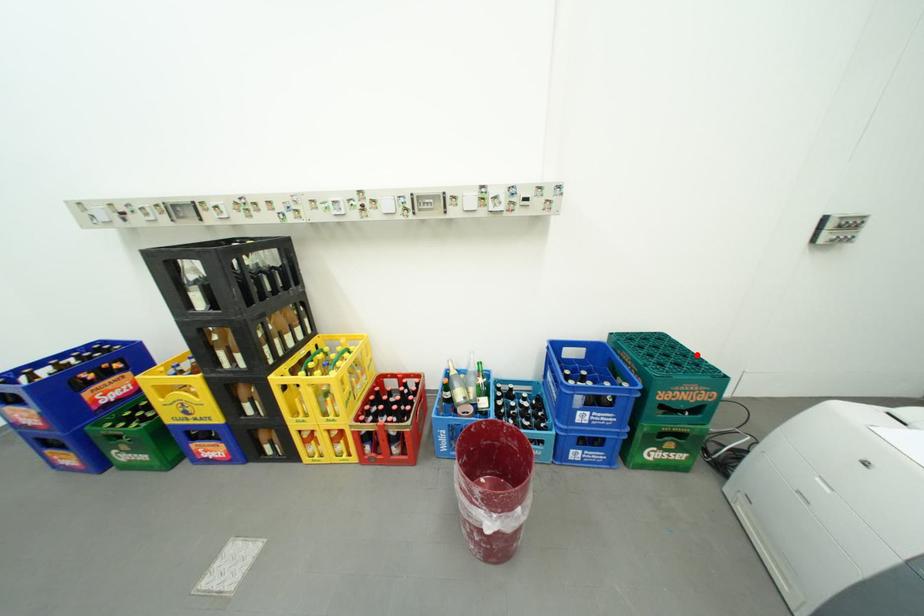
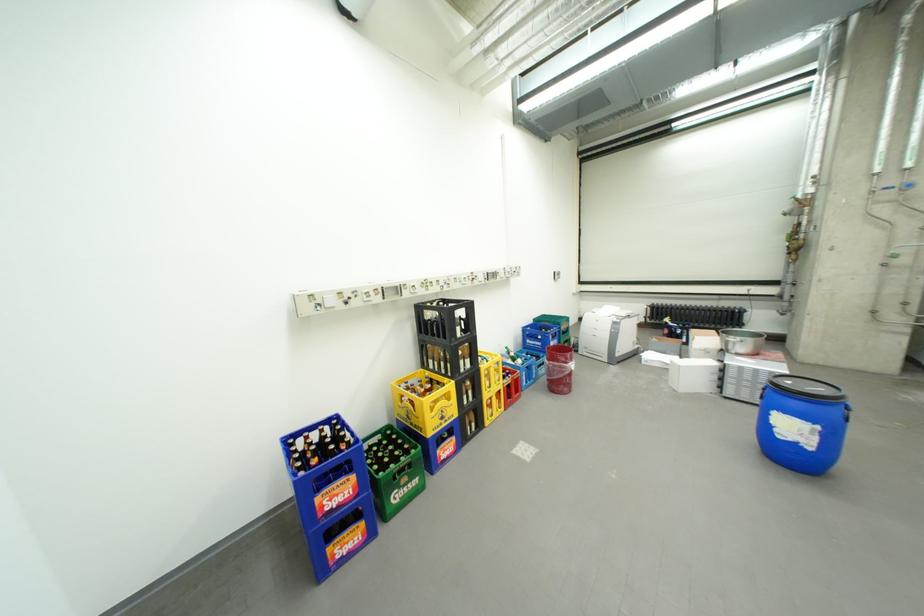
Locate, in the second image, the point that corresponds to the highlighted location in the first image.

(565, 317)